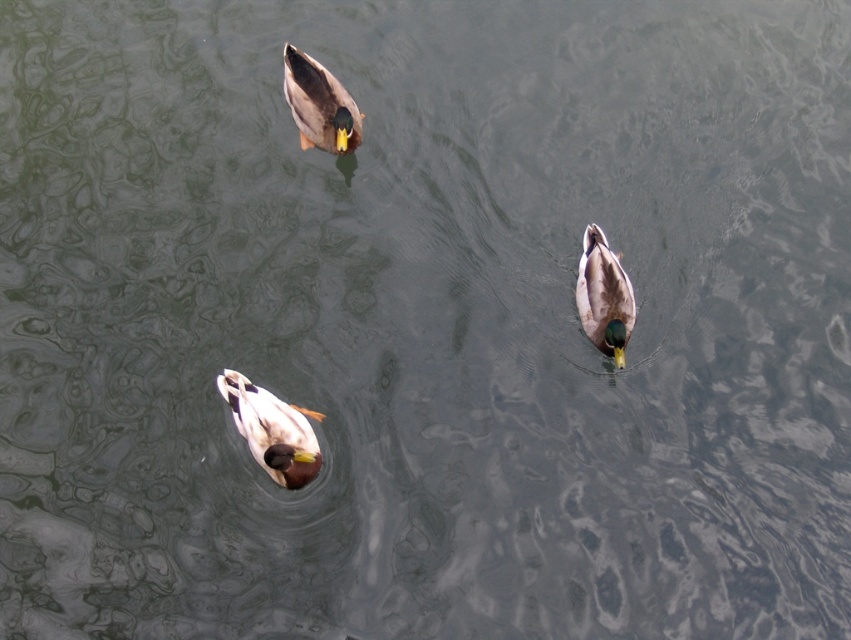
Question: Which of the following is the farthest from the observer?

Choices:
 (A) (318, 120)
 (B) (592, 243)
 (C) (286, 480)

Answer: (A)

Question: Does brown glossy duck at upper left come behind brown matte duck at center?

Choices:
 (A) no
 (B) yes

Answer: (B)

Question: Estimate the real-world distances between objects in this image. Which object is farther from the brown matte duck at center?

Choices:
 (A) brown glossy duck at upper left
 (B) brown-feathered duck at center

Answer: (A)

Question: Which point is farther from the camera taking this photo?

Choices:
 (A) [x=347, y=93]
 (B) [x=603, y=298]
 (C) [x=295, y=474]

Answer: (A)

Question: Does brown-feathered duck at center have a lesser width compared to brown glossy duck at upper left?

Choices:
 (A) yes
 (B) no

Answer: (A)

Question: Is brown-feathered duck at center further to camera compared to brown glossy duck at upper left?

Choices:
 (A) no
 (B) yes

Answer: (A)